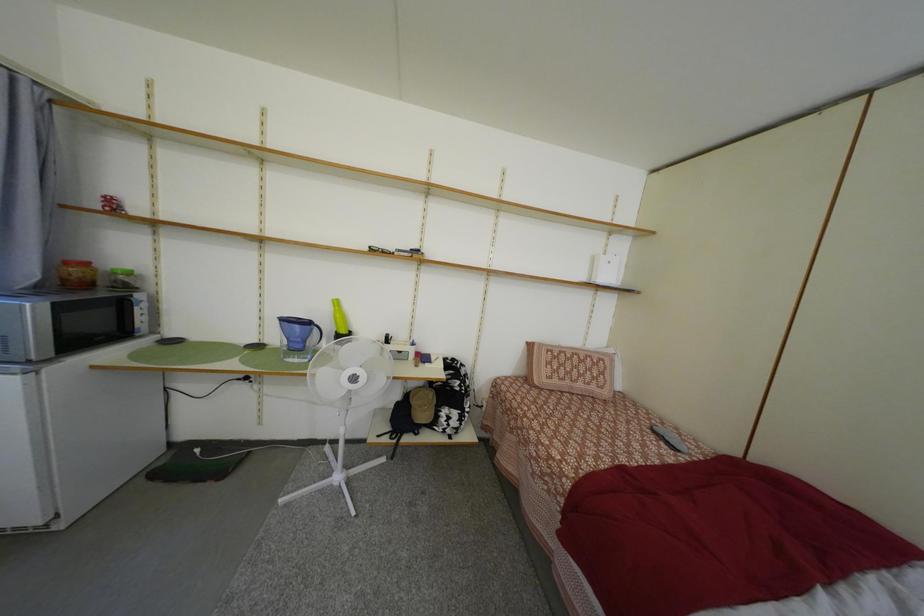
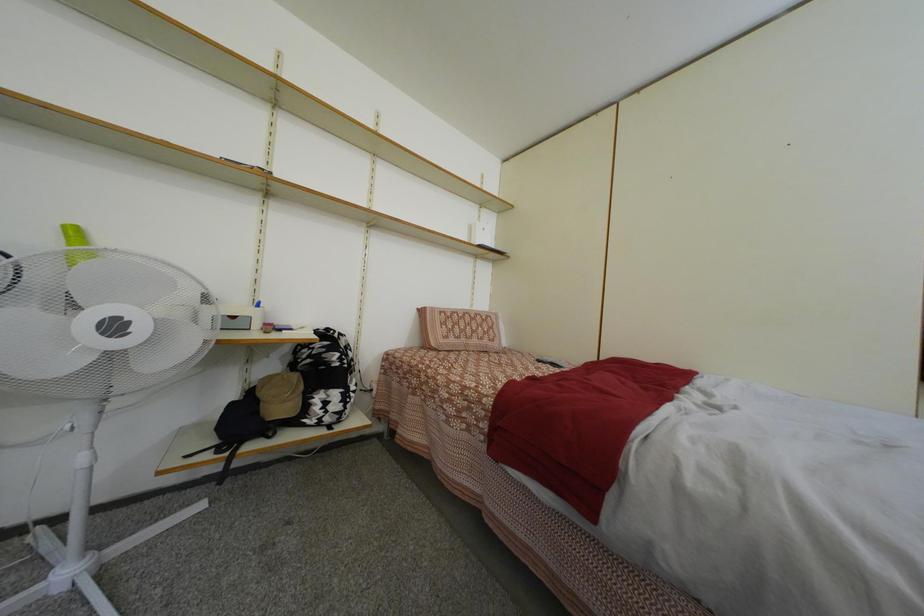
Question: In a continuous first-person perspective shot, in which direction is the camera moving?

Choices:
 (A) Left
 (B) Right
 (C) Forward
 (D) Backward

Answer: (C)